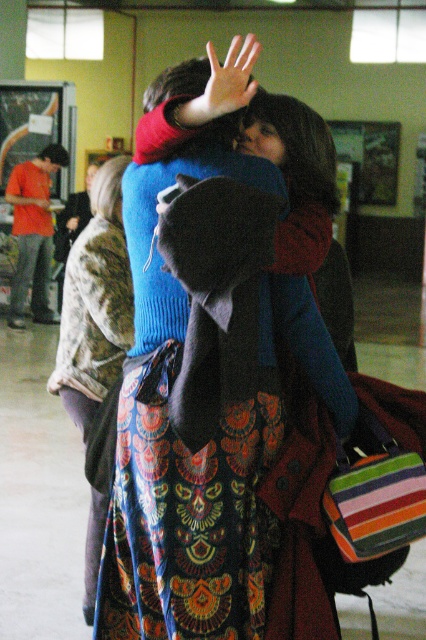
You are organizing a charity event and need to ensure that the two outfits displayed are appropriately sized for their wearers. Given that the matte blue sweater at center and the floral dress at center are both on display, which one requires a larger size based on their visual presentation?

The matte blue sweater at center is bigger than the floral dress at center, so it requires a larger size.

You are a photographer trying to capture a candid shot of the two people in the scene. You notice the smooth skin hand at center and the floral dress at center. Which object is closer to the camera?

The smooth skin hand at center is behind the floral dress at center, so the floral dress at center is closer to the camera.

In the scene shown: You are standing at the point labeled point (247, 58) and want to move to the point labeled point (129, 593). Which direction should you move to get closer to your destination?

You should move towards the direction of the camera because point (129, 593) is closer to the camera than point (247, 58), so moving towards the camera will bring you closer to your destination.